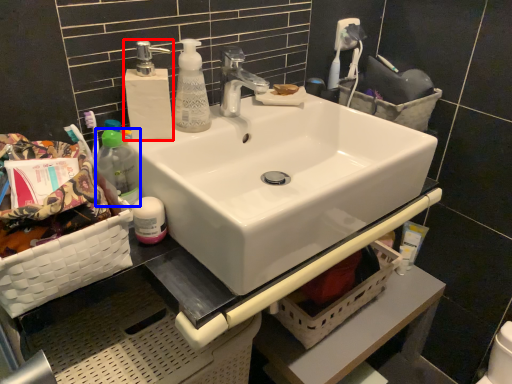
Question: Which point is further to the camera, soap dispenser (highlighted by a red box) or bottle (highlighted by a blue box)?

Choices:
 (A) soap dispenser
 (B) bottle

Answer: (A)